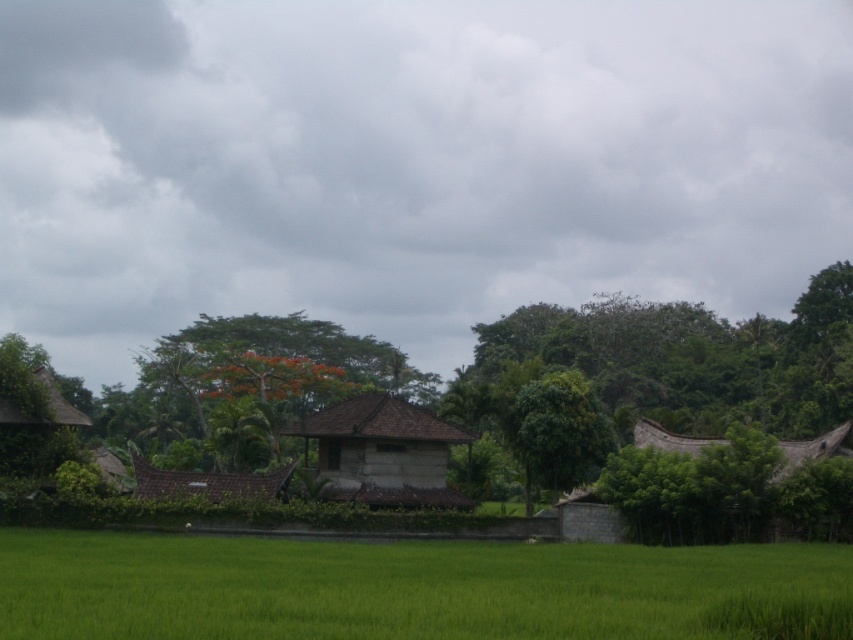
Between brown stone hut at center and brown tile hut at center, which one appears on the right side from the viewer's perspective?

From the viewer's perspective, brown stone hut at center appears more on the right side.

Measure the distance between brown stone hut at center and brown tile hut at center.

They are 4.84 meters apart.

The image size is (853, 640). What do you see at coordinates (383, 452) in the screenshot? I see `brown stone hut at center` at bounding box center [383, 452].

At what (x,y) coordinates should I click in order to perform the action: click on brown stone hut at center. Please return your answer as a coordinate pair (x, y). This screenshot has width=853, height=640. Looking at the image, I should click on (383, 452).

Does green grassy rice field at lower left have a smaller size compared to brown stone hut at center?

Incorrect, green grassy rice field at lower left is not smaller in size than brown stone hut at center.

Is point (642, 573) in front of point (428, 484)?

Yes, point (642, 573) is in front of point (428, 484).

This screenshot has height=640, width=853. I want to click on green grassy rice field at lower left, so click(x=412, y=589).

Is green grassy rice field at lower left to the right of green leafy tree at center from the viewer's perspective?

Incorrect, green grassy rice field at lower left is not on the right side of green leafy tree at center.

Does green grassy rice field at lower left appear over green leafy tree at center?

No.

What do you see at coordinates (412, 589) in the screenshot? I see `green grassy rice field at lower left` at bounding box center [412, 589].

The width and height of the screenshot is (853, 640). What are the coordinates of `green grassy rice field at lower left` in the screenshot? It's located at (412, 589).